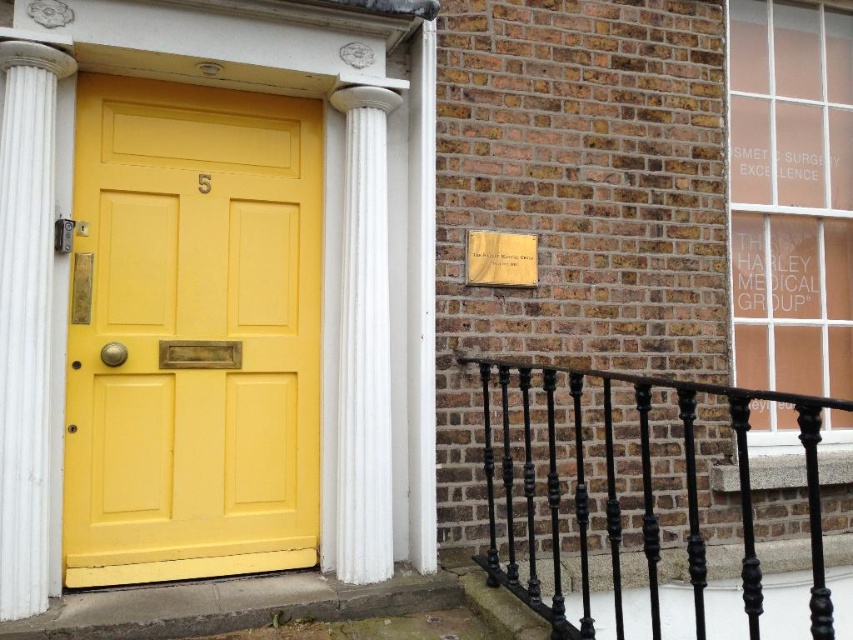
Can you confirm if matte yellow door at center is positioned below white marble column at left?

Correct, matte yellow door at center is located below white marble column at left.

Consider the image. Is matte yellow door at center above white marble column at left?

Actually, matte yellow door at center is below white marble column at left.

Does point (216, 179) come in front of point (35, 576)?

No, (216, 179) is behind (35, 576).

Image resolution: width=853 pixels, height=640 pixels. I want to click on matte yellow door at center, so click(192, 333).

Does matte yellow door at center have a greater height compared to black wrought iron railing at lower right?

Yes, matte yellow door at center is taller than black wrought iron railing at lower right.

Can you confirm if matte yellow door at center is positioned below black wrought iron railing at lower right?

Actually, matte yellow door at center is above black wrought iron railing at lower right.

Image resolution: width=853 pixels, height=640 pixels. What are the coordinates of `matte yellow door at center` in the screenshot? It's located at (192, 333).

Can you confirm if matte yellow door at center is positioned below white marble column at center?

Incorrect, matte yellow door at center is not positioned below white marble column at center.

Can you confirm if matte yellow door at center is thinner than white marble column at center?

No, matte yellow door at center is not thinner than white marble column at center.

Image resolution: width=853 pixels, height=640 pixels. In order to click on matte yellow door at center in this screenshot , I will do `click(192, 333)`.